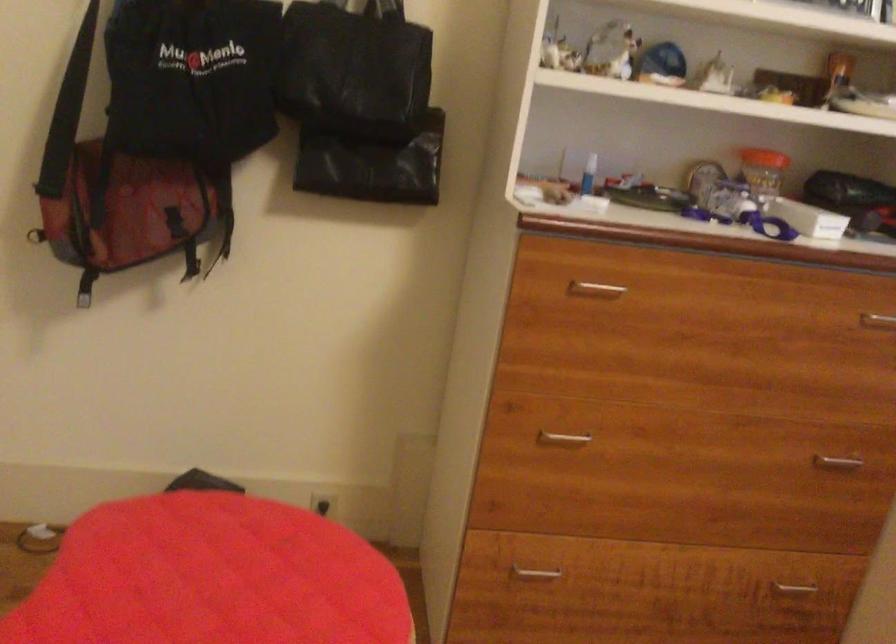
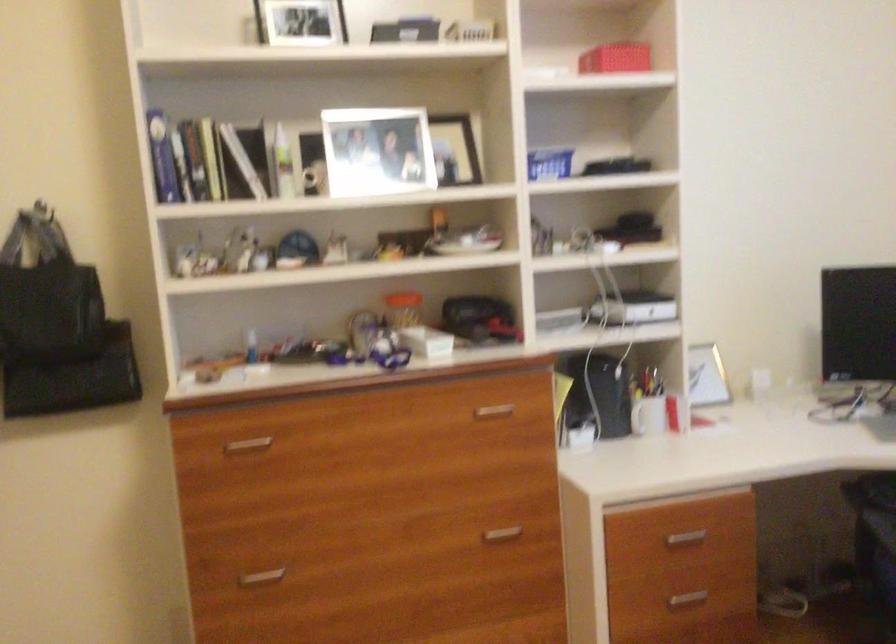
What movement of the cameraman would produce the second image?

The cameraman moved toward right, backward.